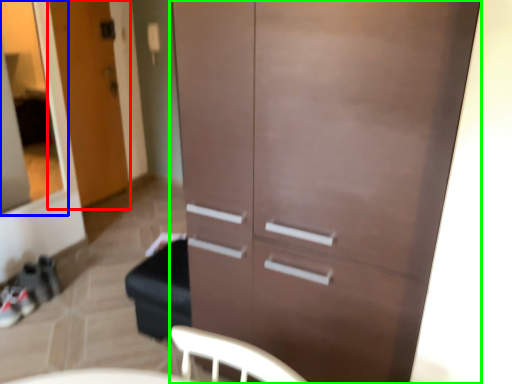
Question: Which object is the closest to the door (highlighted by a red box)? Choose among these: glass door (highlighted by a blue box) or cupboard (highlighted by a green box).

Choices:
 (A) glass door
 (B) cupboard

Answer: (A)